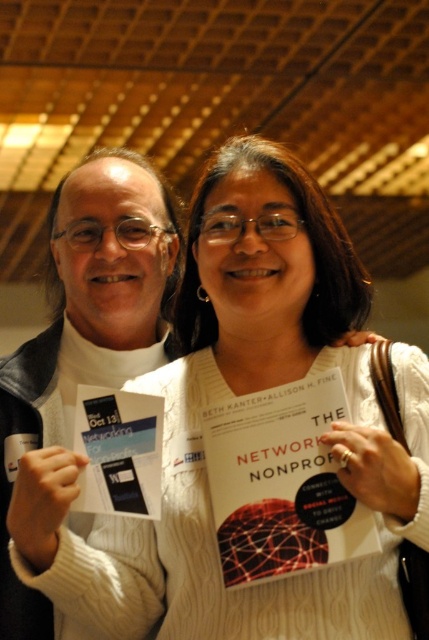
You are an attendee at a conference and see a white paper book at center. There is a point at coordinates (281, 483). Is this point located on the white paper book at center?

Yes, the point at coordinates (281, 483) is located on the white paper book at center as stated in the objects description.

You are organizing a photo shoot and need to ensure that the white sweater at left and the white paper flyer at left are both visible in the frame. Based on their sizes, which object should you prioritize positioning closer to the camera to ensure visibility?

The white sweater at left might be wider than the white paper flyer at left, so prioritizing the white sweater at left closer to the camera would ensure better visibility due to its potentially larger size.

In the scene shown: You are standing in the conference room and see the point marked at coordinates (54,404). If you want to place a 1.5 meter long banner from your current position to that point, will it fit exactly? Please explain.

The distance between you and the point marked at coordinates (54,404) is 1.64 meters. Since the banner is 1.5 meters long, it will not reach the full distance. You need an additional 0.14 meters to cover the space.